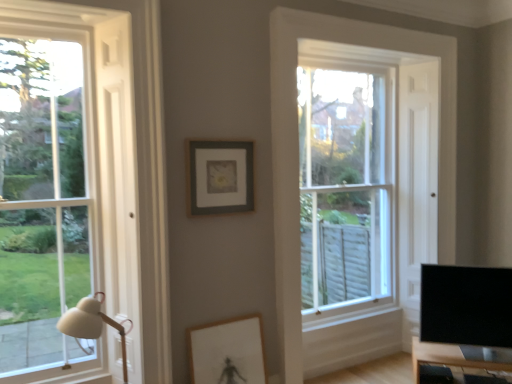
At what (x,y) coordinates should I click in order to perform the action: click on black glossy tv at lower right. Please return your answer as a coordinate pair (x, y). Image resolution: width=512 pixels, height=384 pixels. Looking at the image, I should click on (464, 324).

This screenshot has height=384, width=512. Describe the element at coordinates (346, 186) in the screenshot. I see `clear glass window at center, which is counted as the 1th window, starting from the right` at that location.

What is the approximate width of wooden table at lower right?

16.23 inches.

The image size is (512, 384). In order to click on white matte table lamp at left in this screenshot , I will do point(92,324).

Where is `clear glass window at left, the 1th window from the front`? The height and width of the screenshot is (384, 512). clear glass window at left, the 1th window from the front is located at coordinates (64, 178).

The height and width of the screenshot is (384, 512). Find the location of `black glossy tv at lower right`. black glossy tv at lower right is located at coordinates (464, 324).

Which of these two, wooden table at lower right or black glossy tv at lower right, is thinner?

black glossy tv at lower right is thinner.

Is wooden table at lower right positioned beyond the bounds of black glossy tv at lower right?

Indeed, wooden table at lower right is completely outside black glossy tv at lower right.

From a real-world perspective, between wooden table at lower right and black glossy tv at lower right, who is vertically lower?

wooden table at lower right, from a real-world perspective.

Who is taller, wooden table at lower right or black glossy tv at lower right?

black glossy tv at lower right.

Could you tell me if wooden table at lower right is turned towards white matte table lamp at left?

No.

Does wooden table at lower right appear on the right side of white matte table lamp at left?

Yes.

Considering the sizes of wooden table at lower right and white matte table lamp at left in the image, is wooden table at lower right bigger or smaller than white matte table lamp at left?

Clearly, wooden table at lower right is smaller in size than white matte table lamp at left.

Looking at this image, between wooden table at lower right and white matte table lamp at left, which one has more height?

Standing taller between the two is white matte table lamp at left.

From the image's perspective, is clear glass window at center, which appears as the first window when viewed from the back, located above or below clear glass window at left, the second window positioned from the right?

Clearly, from the image's perspective, clear glass window at center, which appears as the first window when viewed from the back, is above clear glass window at left, the second window positioned from the right.

Is clear glass window at center, which is counted as the 1th window, starting from the right, positioned beyond the bounds of clear glass window at left, acting as the 2th window starting from the back?

clear glass window at center, which is counted as the 1th window, starting from the right, is positioned outside clear glass window at left, acting as the 2th window starting from the back.

Does point (346, 219) lie behind point (105, 232)?

Yes, it is behind point (105, 232).

Is clear glass window at center, which is counted as the 1th window, starting from the right, positioned before clear glass window at left, the 1th window from the front?

No.

Consider the image. Can you confirm if clear glass window at center, which is counted as the 1th window, starting from the right, is taller than white matte table lamp at left?

Yes.

Is white matte table lamp at left at the back of clear glass window at center, the 2th window from the left?

That's not correct — clear glass window at center, the 2th window from the left, is not looking away from white matte table lamp at left.

Choose the correct answer: Is clear glass window at center, which appears as the first window when viewed from the back, inside white matte table lamp at left or outside it?

clear glass window at center, which appears as the first window when viewed from the back, is located beyond the bounds of white matte table lamp at left.

Relative to white matte table lamp at left, is clear glass window at center, the 2th window from the left, in front or behind?

In the image, clear glass window at center, the 2th window from the left, appears behind white matte table lamp at left.

Is wooden table at lower right positioned beyond the bounds of clear glass window at left, positioned as the first window in left-to-right order?

Yes, wooden table at lower right is not within clear glass window at left, positioned as the first window in left-to-right order.

In the scene shown: Can you confirm if wooden table at lower right is smaller than clear glass window at left, the 1th window from the front?

Correct, wooden table at lower right occupies less space than clear glass window at left, the 1th window from the front.

This screenshot has width=512, height=384. Find the location of `window in front of the wooden table at lower right`. window in front of the wooden table at lower right is located at coordinates (64, 178).

Can you confirm if wooden table at lower right is positioned to the right of clear glass window at left, positioned as the first window in left-to-right order?

Yes, wooden table at lower right is to the right of clear glass window at left, positioned as the first window in left-to-right order.

Is black glossy tv at lower right positioned in front of clear glass window at center, which appears as the first window when viewed from the back?

That is True.

Which is behind, point (424, 374) or point (362, 274)?

Point (362, 274)

From the image's perspective, is black glossy tv at lower right above clear glass window at center, which is counted as the 1th window, starting from the right?

No, from the image's perspective, black glossy tv at lower right is not above clear glass window at center, which is counted as the 1th window, starting from the right.

Would you consider black glossy tv at lower right to be distant from clear glass window at center, the 2th window from the left?

No.

Image resolution: width=512 pixels, height=384 pixels. What are the coordinates of `entertainment center that appears below the clear glass window at left, the second window positioned from the right (from a real-world perspective)` in the screenshot? It's located at (464, 324).

Does clear glass window at left, positioned as the first window in left-to-right order, have a greater height compared to black glossy tv at lower right?

Correct, clear glass window at left, positioned as the first window in left-to-right order, is much taller as black glossy tv at lower right.

Which is behind, clear glass window at left, acting as the 2th window starting from the back, or black glossy tv at lower right?

black glossy tv at lower right is further away from the camera.

Does point (110, 19) come farther from viewer compared to point (487, 291)?

No, (110, 19) is in front of (487, 291).

Identify the location of entertainment center above the wooden table at lower right (from a real-world perspective). (464, 324).

This screenshot has height=384, width=512. Find the location of `table lamp that appears in front of the wooden table at lower right`. table lamp that appears in front of the wooden table at lower right is located at coordinates (92, 324).

Looking at the image, which one is located closer to clear glass window at left, positioned as the first window in left-to-right order, wooden table at lower right or black glossy tv at lower right?

black glossy tv at lower right lies closer to clear glass window at left, positioned as the first window in left-to-right order, than the other object.

When comparing their distances from white matte table lamp at left, does matte wooden picture frame at center, acting as the 2th picture frame starting from the top, or clear glass window at left, positioned as the first window in left-to-right order, seem closer?

Among the two, clear glass window at left, positioned as the first window in left-to-right order, is located nearer to white matte table lamp at left.

From the image, which object appears to be farther from matte wooden picture frame at center, arranged as the 1th picture frame when ordered from the bottom, matte gray picture frame at center, which ranks as the second picture frame in bottom-to-top order, or clear glass window at center, the 2th window from the left?

Based on the image, clear glass window at center, the 2th window from the left, appears to be further to matte wooden picture frame at center, arranged as the 1th picture frame when ordered from the bottom.

Based on their spatial positions, is wooden table at lower right or clear glass window at center, which is counted as the 1th window, starting from the right, closer to white matte table lamp at left?

wooden table at lower right is closer to white matte table lamp at left.

From the picture: Which object lies further to the anchor point matte wooden picture frame at center, arranged as the 1th picture frame when ordered from the bottom, matte gray picture frame at center, which ranks as the second picture frame in bottom-to-top order, or black glossy tv at lower right?

black glossy tv at lower right.

Considering their positions, is matte gray picture frame at center, which ranks as the second picture frame in bottom-to-top order, positioned closer to wooden table at lower right than white matte table lamp at left?

Among the two, matte gray picture frame at center, which ranks as the second picture frame in bottom-to-top order, is located nearer to wooden table at lower right.

From the image, which object appears to be nearer to wooden table at lower right, white matte table lamp at left or matte wooden picture frame at center, acting as the 2th picture frame starting from the top?

matte wooden picture frame at center, acting as the 2th picture frame starting from the top.

Based on their spatial positions, is wooden table at lower right or clear glass window at left, positioned as the first window in left-to-right order, closer to black glossy tv at lower right?

Based on the image, wooden table at lower right appears to be nearer to black glossy tv at lower right.

At what (x,y) coordinates should I click in order to perform the action: click on window between white matte table lamp at left and black glossy tv at lower right in the horizontal direction. Please return your answer as a coordinate pair (x, y). The width and height of the screenshot is (512, 384). Looking at the image, I should click on (346, 186).

Where is `entertainment center between matte wooden picture frame at center, arranged as the 1th picture frame when ordered from the bottom, and wooden table at lower right from left to right`? entertainment center between matte wooden picture frame at center, arranged as the 1th picture frame when ordered from the bottom, and wooden table at lower right from left to right is located at coordinates (464, 324).

Locate an element on the screen. This screenshot has height=384, width=512. window between clear glass window at left, the second window positioned from the right, and black glossy tv at lower right is located at coordinates (346, 186).

Where is `window located between white matte table lamp at left and wooden table at lower right in the left-right direction`? This screenshot has width=512, height=384. window located between white matte table lamp at left and wooden table at lower right in the left-right direction is located at coordinates (346, 186).